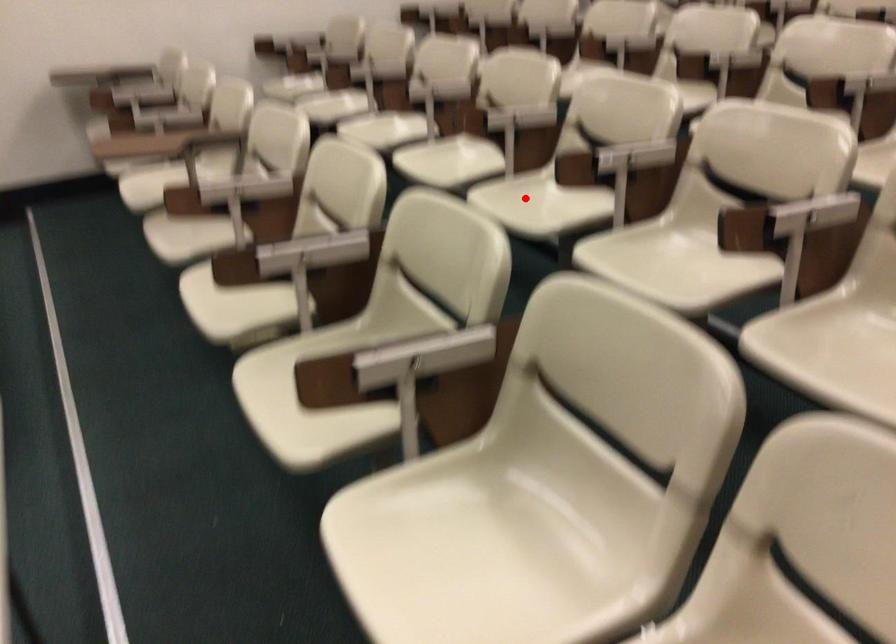
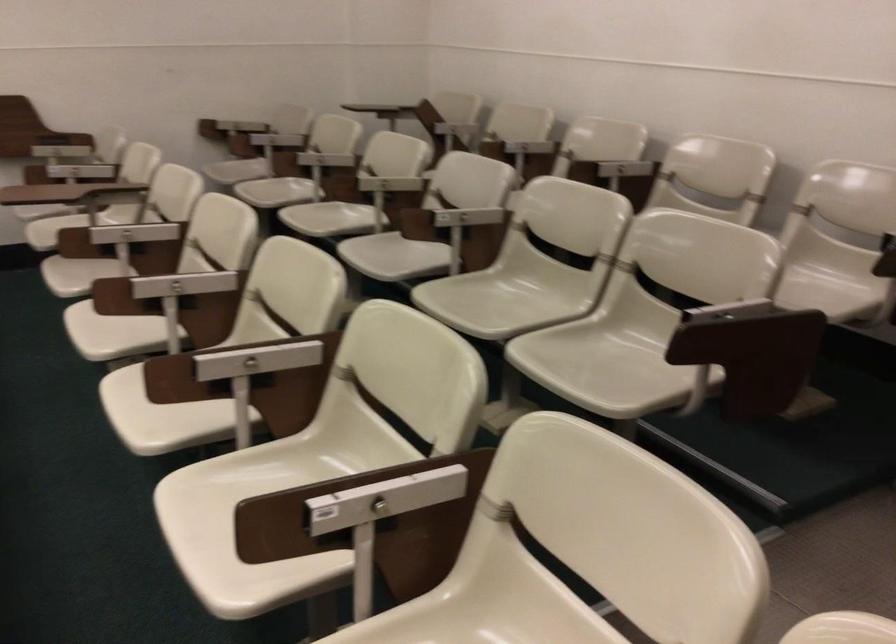
Question: I am providing you with two images of the same scene from different viewpoints. A red point is marked on the first image. Is the red point's position out of view in image 2?

Choices:
 (A) Yes
 (B) No

Answer: (A)